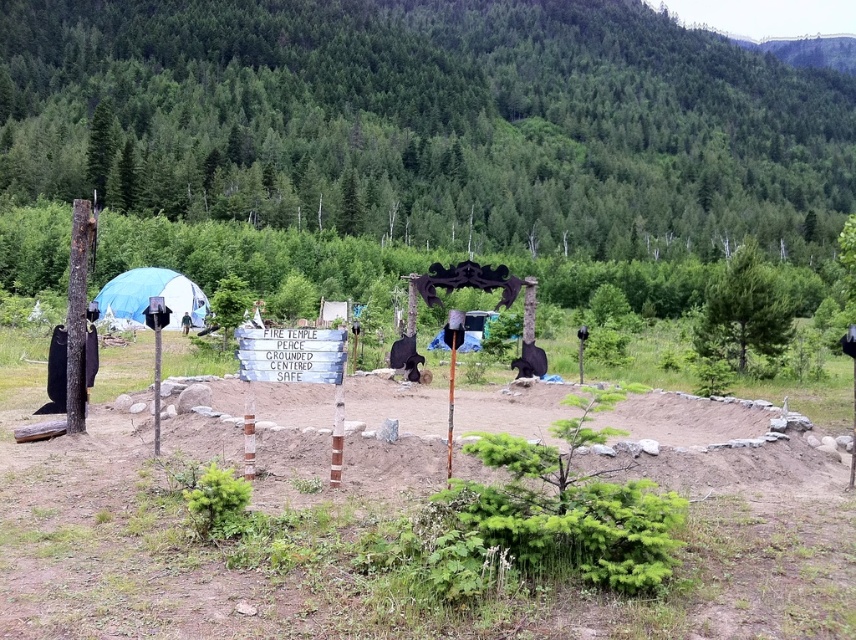
Question: Does white fabric tent at left appear under black fabric at left?

Choices:
 (A) no
 (B) yes

Answer: (A)

Question: Can you confirm if black fabric at left is wider than brushed metal pole at center?

Choices:
 (A) yes
 (B) no

Answer: (A)

Question: Estimate the real-world distances between objects in this image. Which object is farther from the green leafy tree at upper center?

Choices:
 (A) dirt field at center
 (B) black fabric at left

Answer: (B)

Question: Does smooth brown pole at left have a larger size compared to black fabric at left?

Choices:
 (A) no
 (B) yes

Answer: (B)

Question: Which of the following is the closest to the observer?

Choices:
 (A) green leafy tree at upper center
 (B) black fabric at left
 (C) dirt field at center

Answer: (C)

Question: Among these objects, which one is nearest to the camera?

Choices:
 (A) green leafy tree at upper right
 (B) black fabric at left
 (C) smooth brown pole at left

Answer: (C)